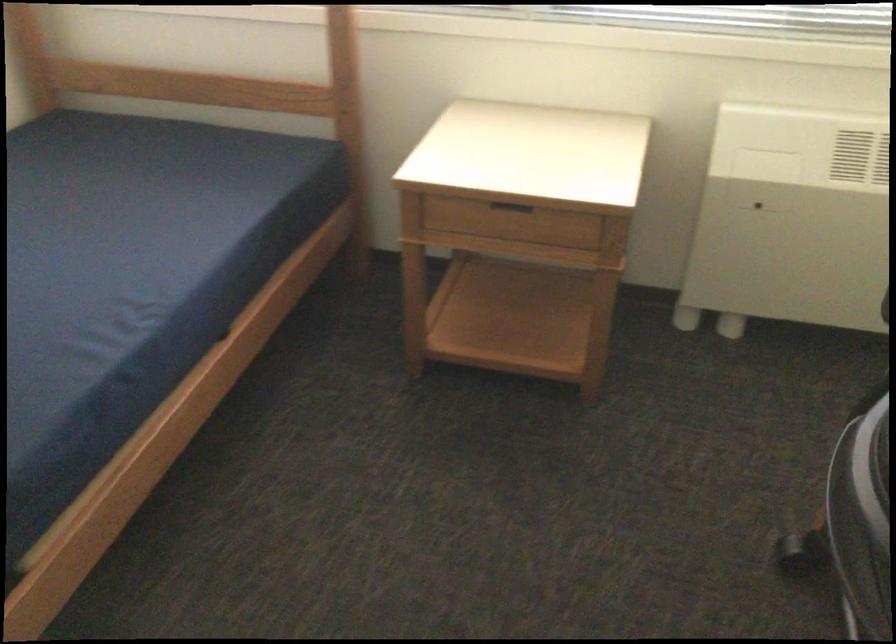
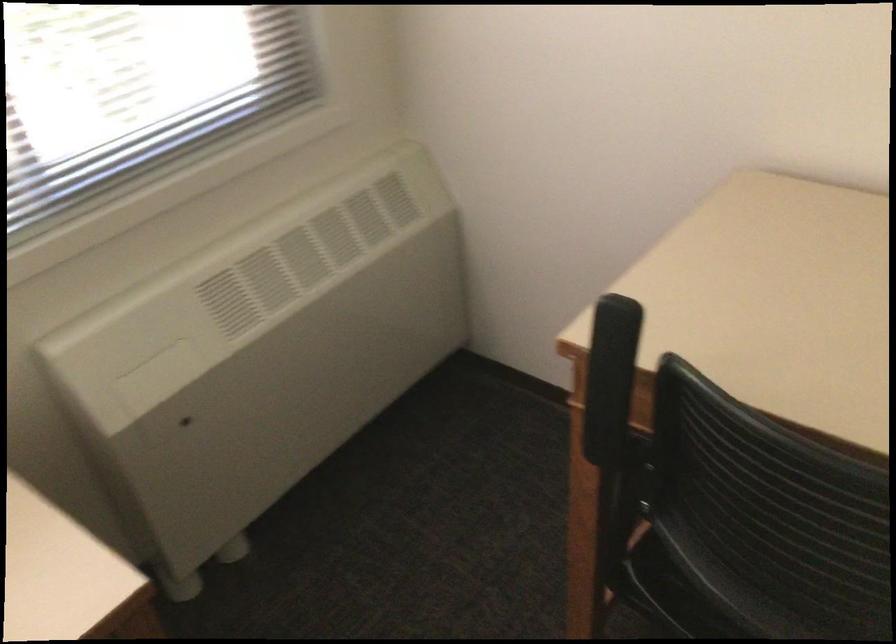
How did the camera likely rotate?

The rotation direction of the camera is right-down.